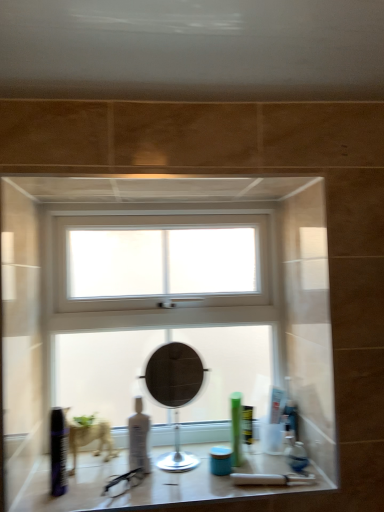
The width and height of the screenshot is (384, 512). Identify the location of vacant region in front of blue matte jar at center, the third toiletry from the left. (225, 494).